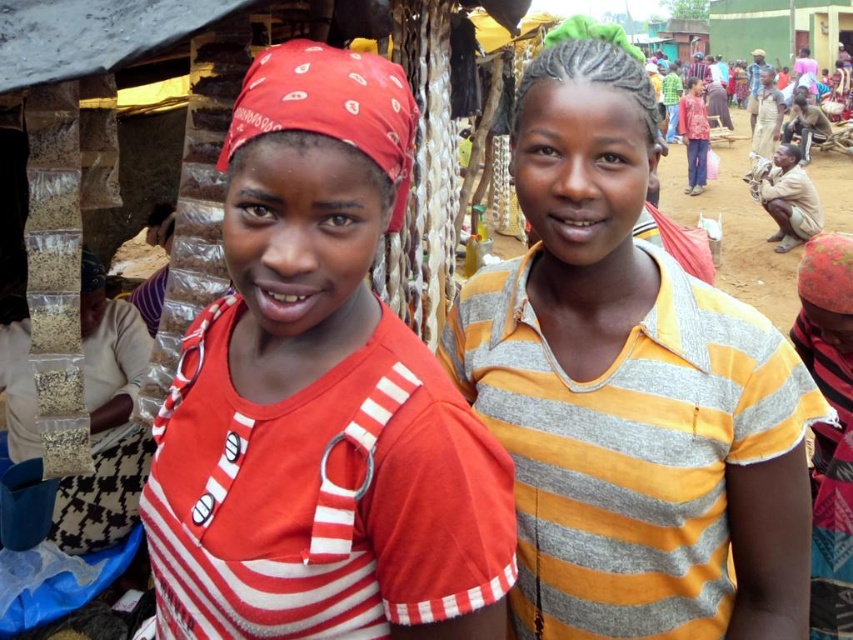
Question: Can you confirm if matte red bandana at left is positioned below yellow striped shirt at center?

Choices:
 (A) no
 (B) yes

Answer: (B)

Question: Which of the following is the farthest from the observer?

Choices:
 (A) (466, 376)
 (B) (372, 236)

Answer: (A)

Question: Is matte red bandana at left below yellow striped shirt at center?

Choices:
 (A) yes
 (B) no

Answer: (A)

Question: Among these points, which one is nearest to the camera?

Choices:
 (A) (641, 392)
 (B) (318, 72)

Answer: (B)

Question: Is matte red bandana at left to the left of yellow striped shirt at center from the viewer's perspective?

Choices:
 (A) yes
 (B) no

Answer: (A)